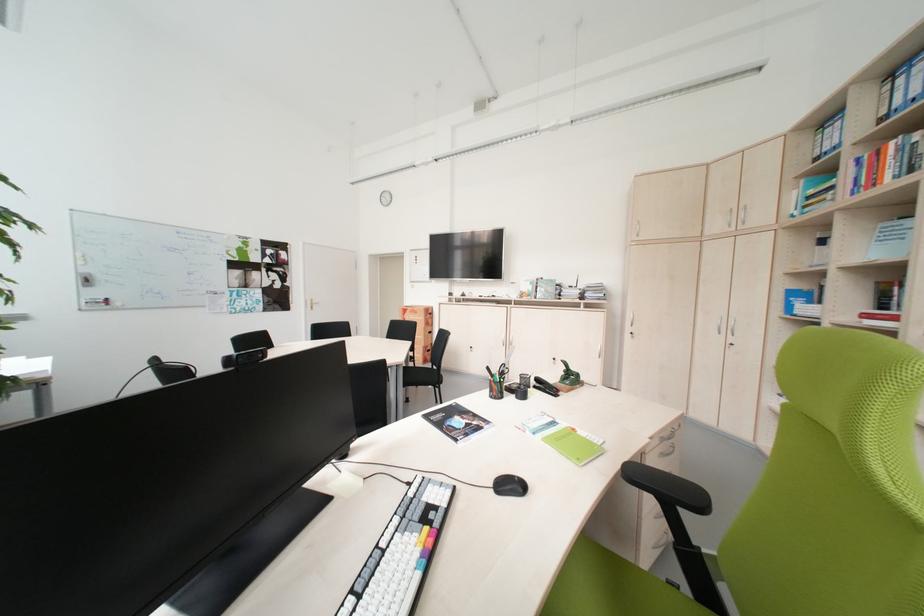
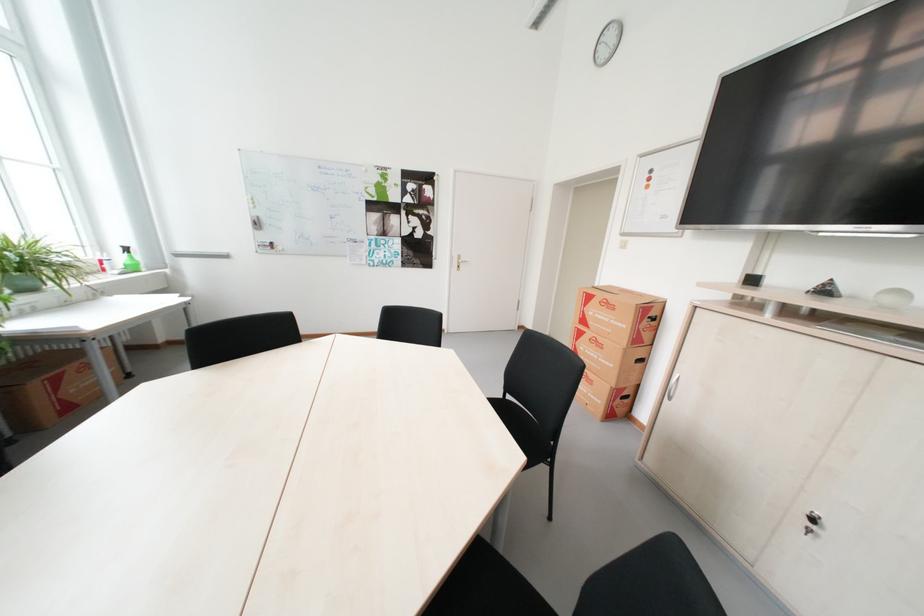
Locate, in the second image, the point that corresponds to (433,354) in the first image.

(622, 400)